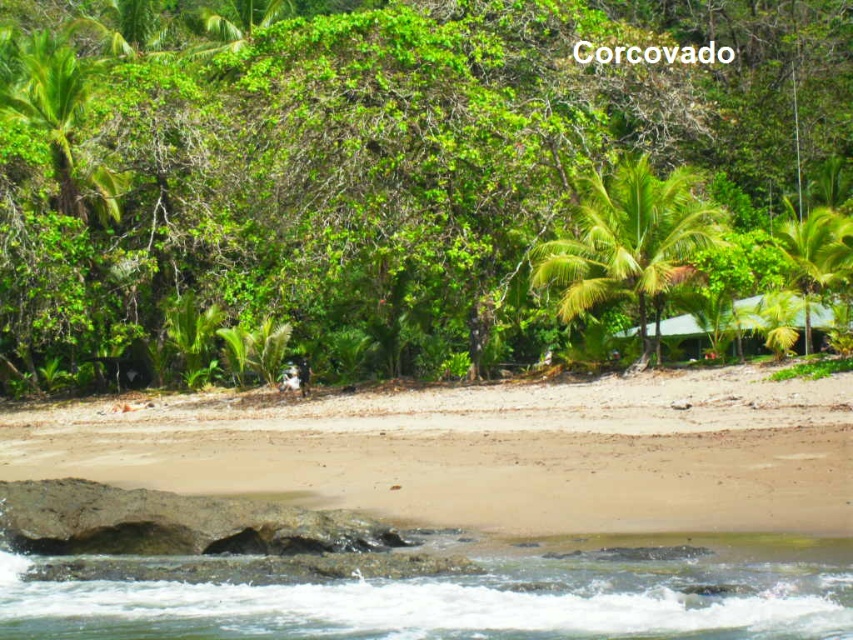
You are standing on the tropical beach at Corcovado and want to walk towards the two points marked in the scene. Which point, point (515,497) or point (558,259), will you reach first?

Point (515,497) is closer to the viewer than point (558,259), so you will reach point (515,497) first.

You are standing on the beige sandy beach at lower center and want to walk to the green leafy palm tree at center. Which direction should you move to get closer to the palm tree?

The beige sandy beach at lower center is closer to the viewer than the green leafy palm tree at center, so to reach the palm tree, you should move forward away from the shoreline towards the midground where the palm tree is located.